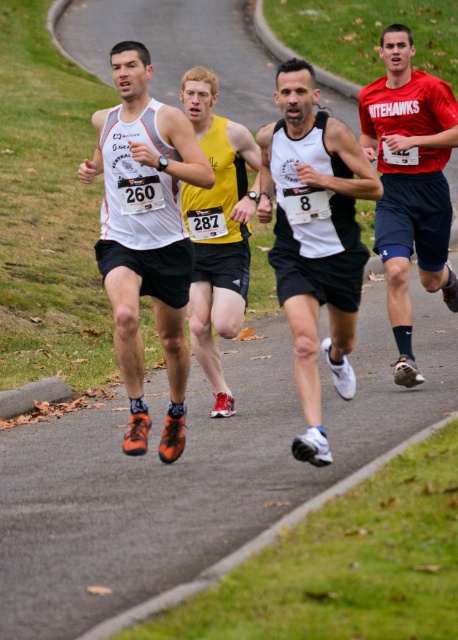
Question: Which point is closer to the camera?

Choices:
 (A) yellow matte singlet at center
 (B) matte white tank top at center
 (C) red matte jersey at center

Answer: (B)

Question: From the image, what is the correct spatial relationship of matte white tank top at center in relation to red matte jersey at center?

Choices:
 (A) left
 (B) right

Answer: (A)

Question: Does matte white tank top at center have a larger size compared to yellow matte singlet at center?

Choices:
 (A) no
 (B) yes

Answer: (B)

Question: Which object appears farthest from the camera in this image?

Choices:
 (A) yellow matte singlet at center
 (B) red matte jersey at center

Answer: (B)

Question: Is red matte jersey at center to the left of yellow matte singlet at center from the viewer's perspective?

Choices:
 (A) yes
 (B) no

Answer: (B)

Question: Which object is positioned farthest from the red matte jersey at center?

Choices:
 (A) white matte tank top at center
 (B) yellow matte singlet at center

Answer: (A)